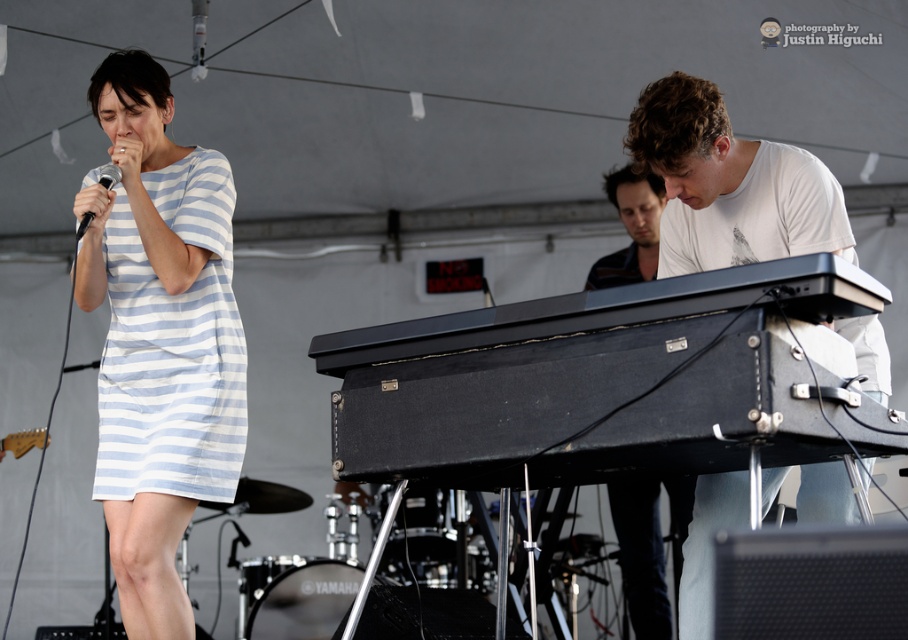
Question: Which of these objects is positioned closest to the white matte keyboard at right?

Choices:
 (A) matte black microphone at left
 (B) white matte keyboard at center
 (C) light blue and white striped fabric dress at left

Answer: (C)

Question: Is light blue and white striped fabric dress at left in front of white matte keyboard at right?

Choices:
 (A) no
 (B) yes

Answer: (A)

Question: Which is farther from the black leather piano at center?

Choices:
 (A) white matte keyboard at center
 (B) light blue and white striped fabric dress at left
 (C) white matte keyboard at right

Answer: (A)

Question: Where is white matte keyboard at right located in relation to white matte keyboard at center in the image?

Choices:
 (A) left
 (B) right

Answer: (A)

Question: Can you confirm if black leather piano at center is positioned to the right of light blue and white striped fabric dress at left?

Choices:
 (A) yes
 (B) no

Answer: (A)

Question: Which of the following is the farthest from the observer?

Choices:
 (A) (114, 184)
 (B) (666, 486)
 (C) (716, 305)

Answer: (B)